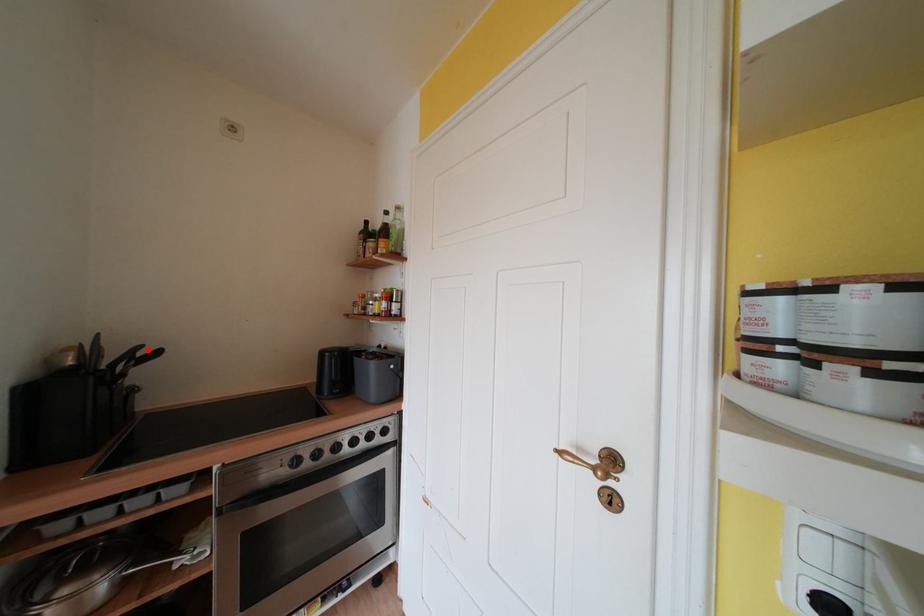
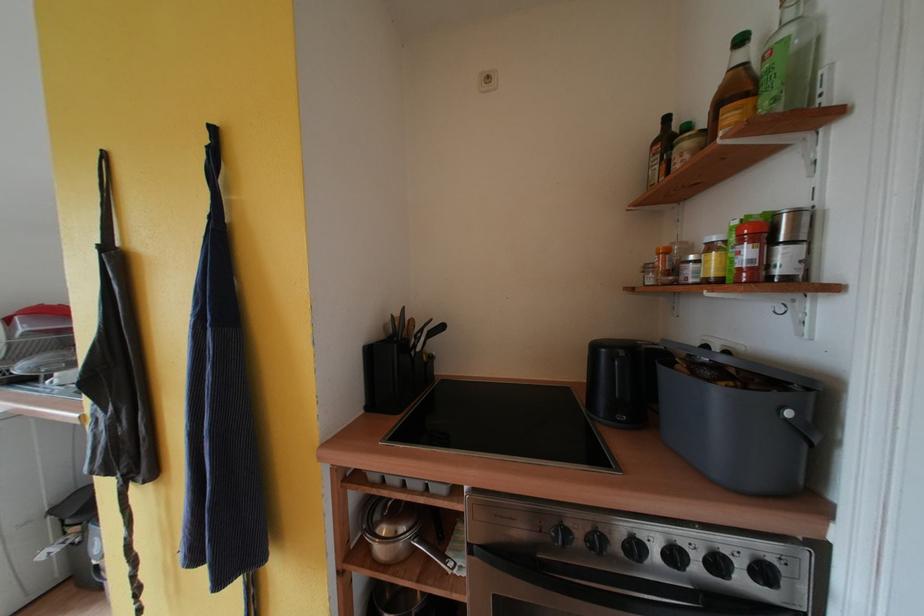
The point at the highlighted location is marked in the first image. Where is the corresponding point in the second image?

(436, 323)